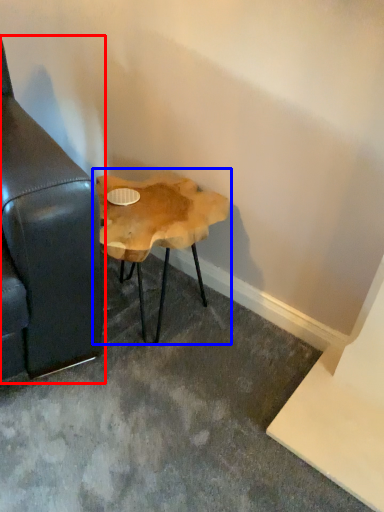
Question: Which point is further to the camera, studio couch (highlighted by a red box) or table (highlighted by a blue box)?

Choices:
 (A) studio couch
 (B) table

Answer: (B)